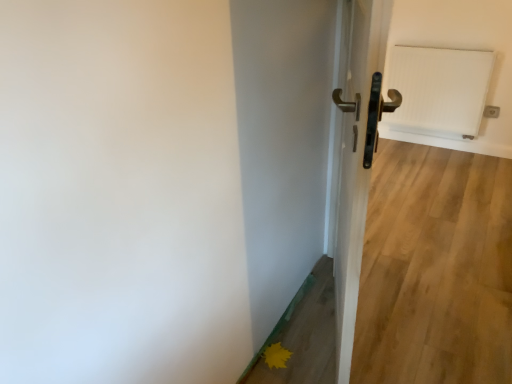
Locate an element on the screen. vacant space underneath metallic gold door handle at center (from a real-world perspective) is located at coordinates (328, 319).